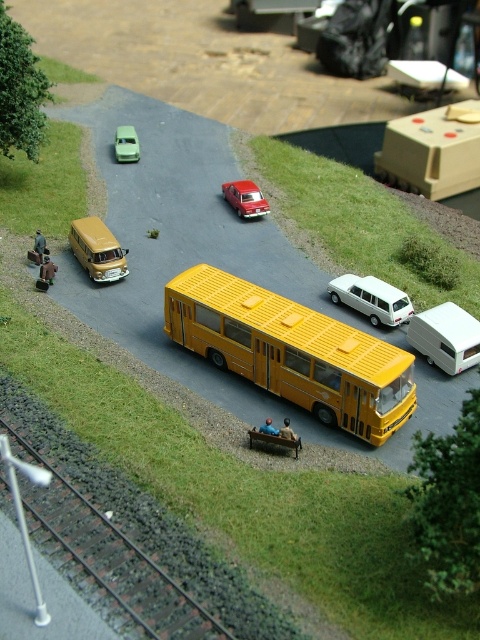
Question: Can you confirm if yellow matte bus at center is smaller than black gravel train track at lower left?

Choices:
 (A) no
 (B) yes

Answer: (A)

Question: Which point is farther to the camera?

Choices:
 (A) (159, 612)
 (B) (259, 202)
 (C) (122, 264)
 (D) (227, 362)

Answer: (B)

Question: Which of the following is the closest to the observer?

Choices:
 (A) (237, 205)
 (B) (146, 624)
 (C) (344, 284)
 (D) (126, 131)

Answer: (B)

Question: Can you confirm if metallic gold van at left is thinner than shiny red car at center?

Choices:
 (A) no
 (B) yes

Answer: (A)

Question: Does yellow matte bus at center have a smaller size compared to metallic gold van at left?

Choices:
 (A) yes
 (B) no

Answer: (B)

Question: Which object is positioned closest to the white matte station wagon at center?

Choices:
 (A) black gravel train track at lower left
 (B) shiny red car at center
 (C) yellow matte bus at center
 (D) metallic gold van at left

Answer: (C)